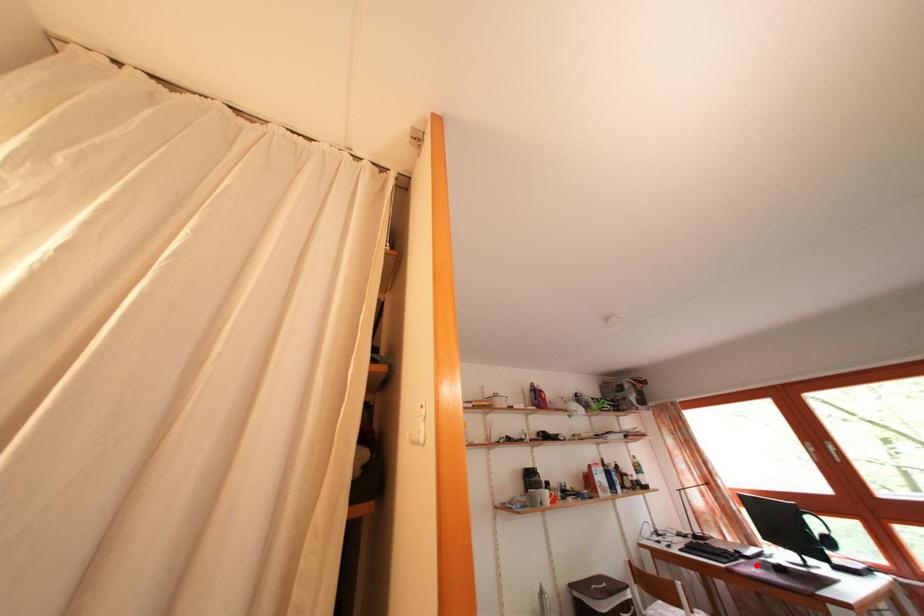
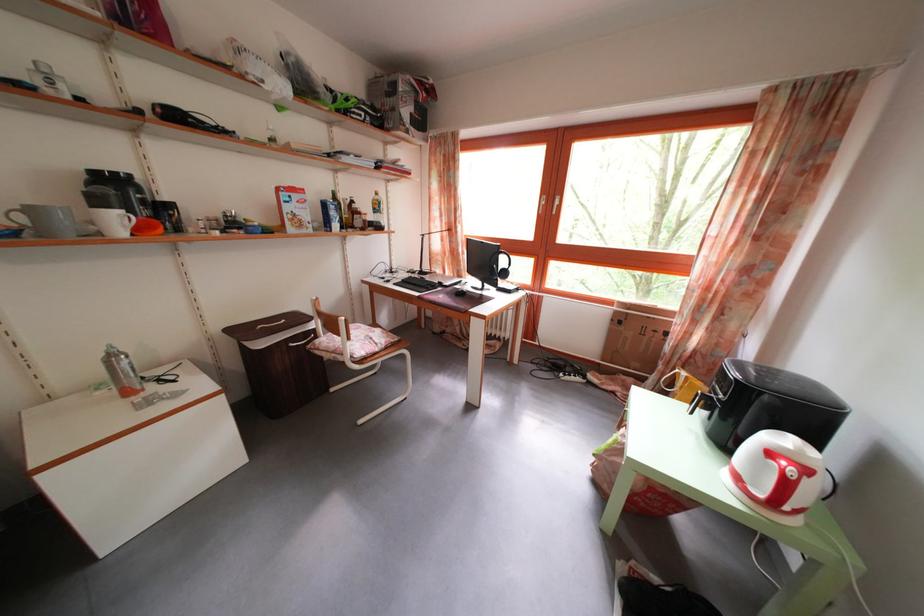
Question: I am providing you with two images of the same scene from different viewpoints. In image1, a red point is highlighted. Considering the same 3D point in image2, which of the following is correct?

Choices:
 (A) It is closer
 (B) It is farther

Answer: (B)